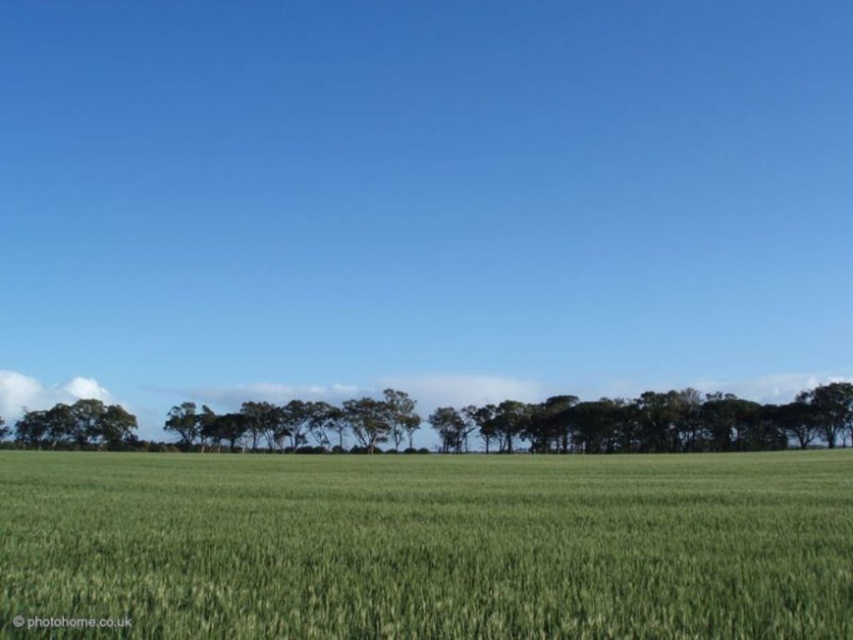
Question: Among these points, which one is farthest from the camera?

Choices:
 (A) (264, 504)
 (B) (73, 435)

Answer: (B)

Question: Does green grassy wheat field at center lie in front of green leafy tree at center?

Choices:
 (A) no
 (B) yes

Answer: (B)

Question: Which object appears closest to the camera in this image?

Choices:
 (A) green leafy tree at center
 (B) green grassy wheat field at center

Answer: (B)

Question: Where is green grassy wheat field at center located in relation to green leafy tree at center in the image?

Choices:
 (A) right
 (B) left

Answer: (A)

Question: In this image, where is green grassy wheat field at center located relative to green leafy tree at center?

Choices:
 (A) right
 (B) left

Answer: (A)

Question: Which object appears farthest from the camera in this image?

Choices:
 (A) green leafy tree at center
 (B) green grassy wheat field at center

Answer: (A)